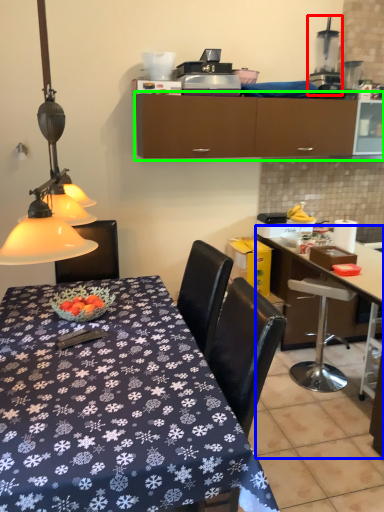
Question: Considering the real-world distances, which object is closest to appliance (highlighted by a red box)? desk (highlighted by a blue box) or cabinetry (highlighted by a green box).

Choices:
 (A) desk
 (B) cabinetry

Answer: (B)